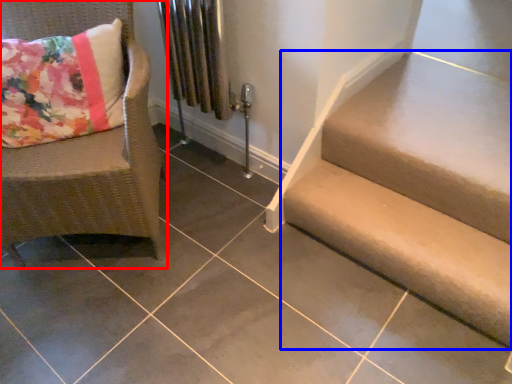
Question: Which object is further to the camera taking this photo, chair (highlighted by a red box) or stairs (highlighted by a blue box)?

Choices:
 (A) chair
 (B) stairs

Answer: (B)